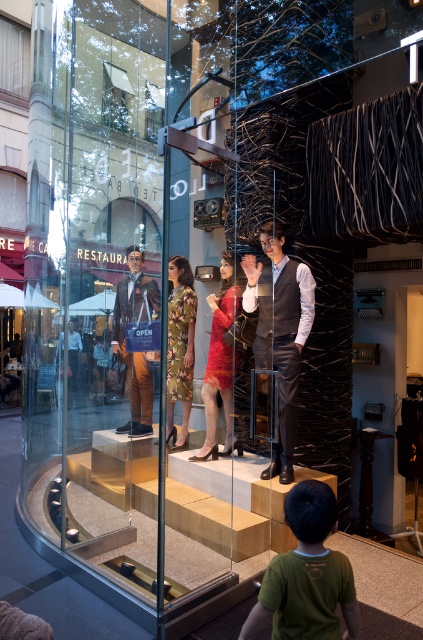
Question: Which object appears farthest from the camera in this image?

Choices:
 (A) green t-shirt at lower center
 (B) matte brown suit at center
 (C) matte black vest at center

Answer: (B)

Question: Can you confirm if matte black vest at center is positioned above matte brown suit at center?

Choices:
 (A) yes
 (B) no

Answer: (B)

Question: Is matte brown suit at center to the left of red satin dress at center from the viewer's perspective?

Choices:
 (A) yes
 (B) no

Answer: (A)

Question: Estimate the real-world distances between objects in this image. Which object is closer to the green t-shirt at lower center?

Choices:
 (A) matte black vest at center
 (B) matte brown suit at center

Answer: (A)

Question: Is green t-shirt at lower center to the right of red satin dress at center from the viewer's perspective?

Choices:
 (A) yes
 (B) no

Answer: (A)

Question: Which point appears closest to the camera in this image?

Choices:
 (A) (136, 284)
 (B) (277, 458)
 (C) (214, 442)

Answer: (B)